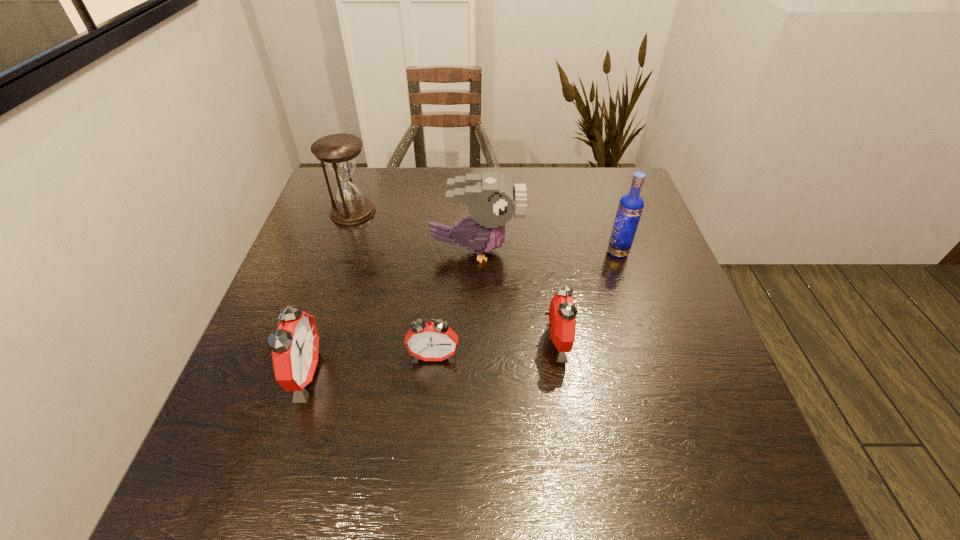
Locate an element on the screen. The height and width of the screenshot is (540, 960). vacant region located 0.130m on the clock face of the rightmost alarm clock is located at coordinates (629, 341).

This screenshot has height=540, width=960. In order to click on vacant space located on the right of the hourglass in this screenshot , I will do `click(432, 212)`.

You are a GUI agent. You are given a task and a screenshot of the screen. Output one action in this format:
    pyautogui.click(x=<x>, y=<y>)
    Task: Click on the free spot located at the beak of the bird
    The width and height of the screenshot is (960, 540).
    Given the screenshot: What is the action you would take?
    pyautogui.click(x=548, y=251)

This screenshot has height=540, width=960. I want to click on vacant space situated on the left of the rightmost object, so click(584, 253).

This screenshot has height=540, width=960. What are the coordinates of `object that is at the far edge` in the screenshot? It's located at (339, 151).

The height and width of the screenshot is (540, 960). Find the location of `object at the near edge`. object at the near edge is located at coordinates (295, 347).

This screenshot has width=960, height=540. In order to click on alarm clock located at the left edge in this screenshot , I will do `click(295, 347)`.

The image size is (960, 540). I want to click on hourglass located in the left edge section of the desktop, so pyautogui.click(x=339, y=151).

Locate an element on the screen. This screenshot has height=540, width=960. object that is at the right edge is located at coordinates (631, 205).

Find the location of a particular element. This screenshot has width=960, height=540. object situated at the far left corner is located at coordinates (339, 151).